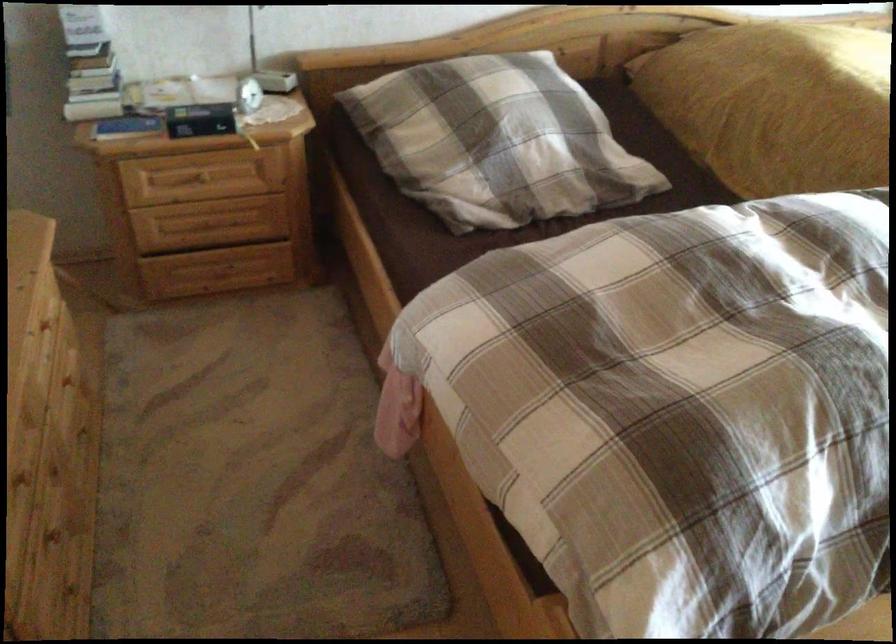
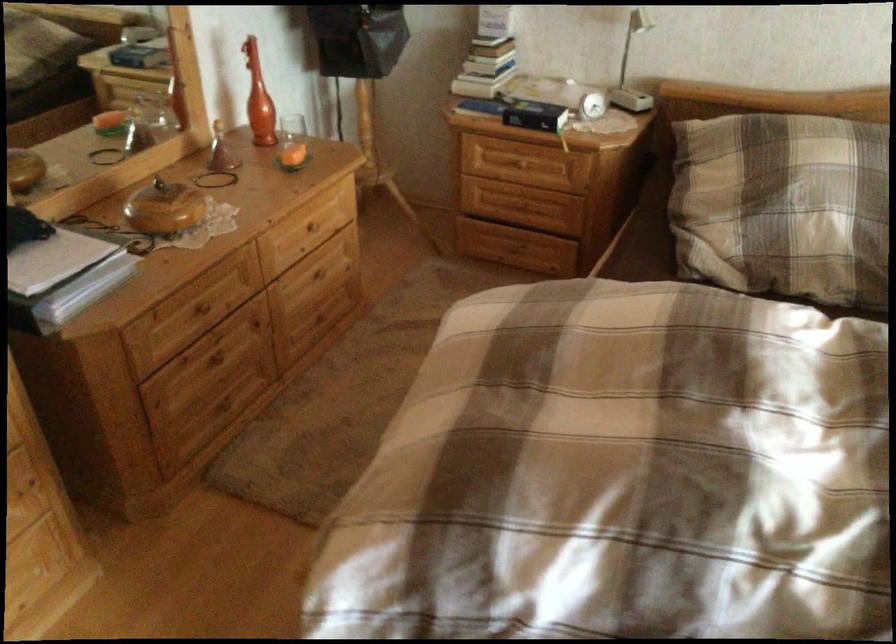
Where in the second image is the point corresponding to the point at 97,70 from the first image?

(487, 49)